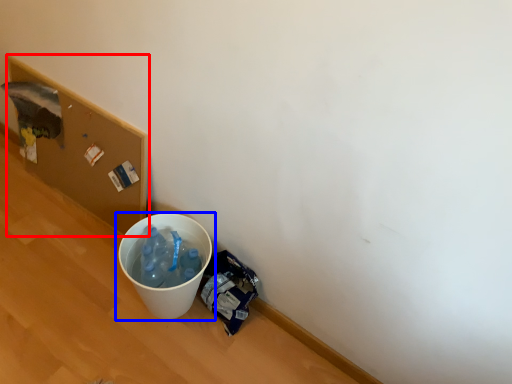
Question: Among these objects, which one is farthest to the camera, cardboard box (highlighted by a red box) or waste container (highlighted by a blue box)?

Choices:
 (A) cardboard box
 (B) waste container

Answer: (A)